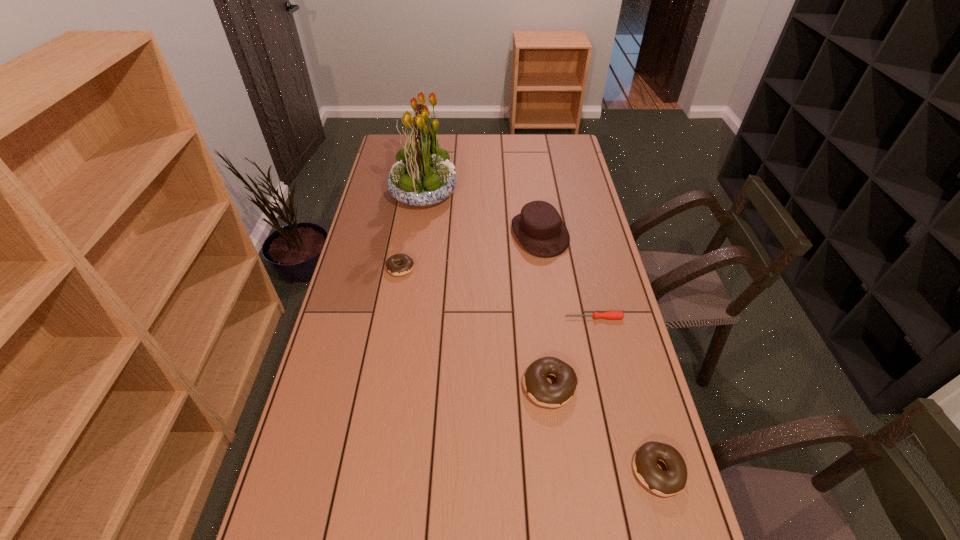
The width and height of the screenshot is (960, 540). Identify the location of vacant space located 0.150m on the right of the shortest doughnut. (457, 268).

You are a GUI agent. You are given a task and a screenshot of the screen. Output one action in this format:
    pyautogui.click(x=<x>, y=<y>)
    Task: Click on the vacant space located 0.050m on the front of the second nearest doughnut
    The image size is (960, 540).
    Given the screenshot: What is the action you would take?
    pyautogui.click(x=555, y=429)

Find the location of a particular element. The image size is (960, 540). vacant space located 0.370m on the back of the second tallest doughnut is located at coordinates (618, 328).

The height and width of the screenshot is (540, 960). Identify the location of vacant point located 0.310m on the front-facing side of the tallest object. (531, 192).

Find the location of `vacant space located on the left of the fifth shortest object`. vacant space located on the left of the fifth shortest object is located at coordinates (459, 234).

Where is `blank space located 0.190m at the tip of the shortest object`? Image resolution: width=960 pixels, height=540 pixels. blank space located 0.190m at the tip of the shortest object is located at coordinates (505, 318).

I want to click on vacant space situated 0.170m at the tip of the shortest object, so click(512, 318).

Locate an element on the screen. free point located 0.260m at the tip of the shortest object is located at coordinates (483, 318).

The image size is (960, 540). Find the location of `object present at the near edge`. object present at the near edge is located at coordinates coord(672,481).

Locate an element on the screen. doughnut located in the left edge section of the desktop is located at coordinates (392, 262).